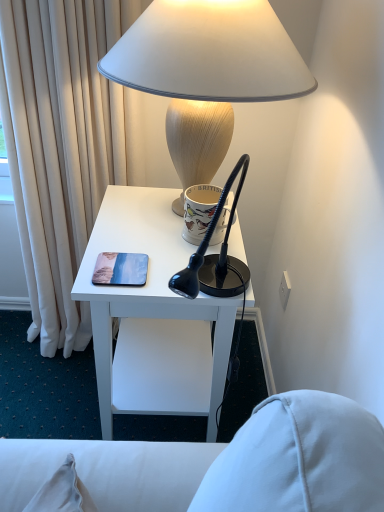
Locate an element on the screen. Image resolution: width=384 pixels, height=512 pixels. free space to the left of white ceramic mug at upper center is located at coordinates pos(144,230).